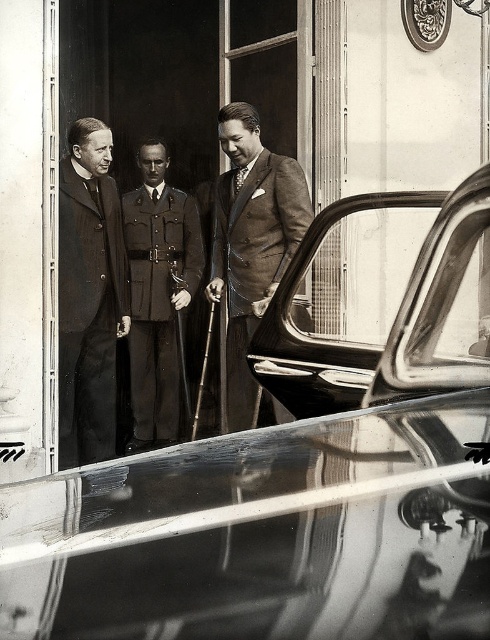
Does smooth dark coat at left have a larger size compared to brown wool suit at center?

Incorrect, smooth dark coat at left is not larger than brown wool suit at center.

Is smooth dark coat at left shorter than brown wool suit at center?

Incorrect, smooth dark coat at left's height does not fall short of brown wool suit at center's.

Does point (87, 333) lie in front of point (227, 122)?

No, it is behind (227, 122).

Find the location of `smooth dark coat at left`. smooth dark coat at left is located at coordinates (89, 296).

Can you confirm if shiny chrome car at center is taller than brown wool suit at center?

In fact, shiny chrome car at center may be shorter than brown wool suit at center.

Can you confirm if shiny chrome car at center is positioned to the right of brown wool suit at center?

Yes, shiny chrome car at center is to the right of brown wool suit at center.

Identify the location of shiny chrome car at center. (274, 520).

From the picture: Is shiny chrome door at center taller than brown wool suit at center?

No.

Identify the location of shiny chrome door at center. The height and width of the screenshot is (640, 490). (390, 305).